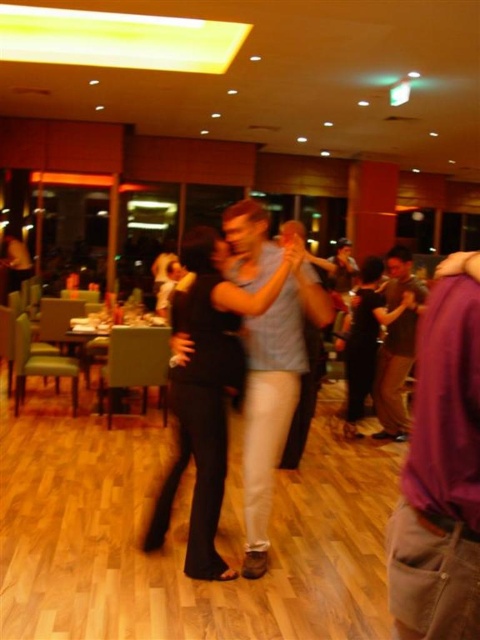
Is purple cotton shirt at right shorter than brown cotton shirt at right?

Yes, purple cotton shirt at right is shorter than brown cotton shirt at right.

Between purple cotton shirt at right and brown cotton shirt at right, which one has less height?

With less height is purple cotton shirt at right.

Who is more distant from viewer, (447, 262) or (421, 298)?

The point (421, 298) is behind.

Identify the location of purple cotton shirt at right. (442, 470).

Who is positioned more to the left, purple cotton shirt at right or light blue cotton shirt at center?

From the viewer's perspective, light blue cotton shirt at center appears more on the left side.

Which is above, purple cotton shirt at right or light blue cotton shirt at center?

purple cotton shirt at right is above.

Is point (425, 605) behind point (304, 356)?

No, (425, 605) is in front of (304, 356).

The image size is (480, 640). Identify the location of purple cotton shirt at right. (442, 470).

Who is higher up, light blue cotton shirt at center or brown cotton shirt at right?

Positioned higher is brown cotton shirt at right.

Does point (297, 243) come closer to viewer compared to point (395, 368)?

Yes, point (297, 243) is in front of point (395, 368).

Where is `light blue cotton shirt at center`? Image resolution: width=480 pixels, height=640 pixels. light blue cotton shirt at center is located at coordinates (274, 394).